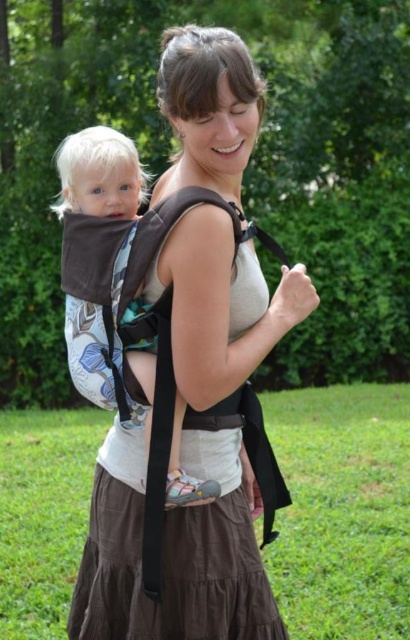
Who is higher up, brown fabric carrier at center or black fabric strap at upper center?

brown fabric carrier at center

This screenshot has height=640, width=410. I want to click on brown fabric carrier at center, so click(x=180, y=369).